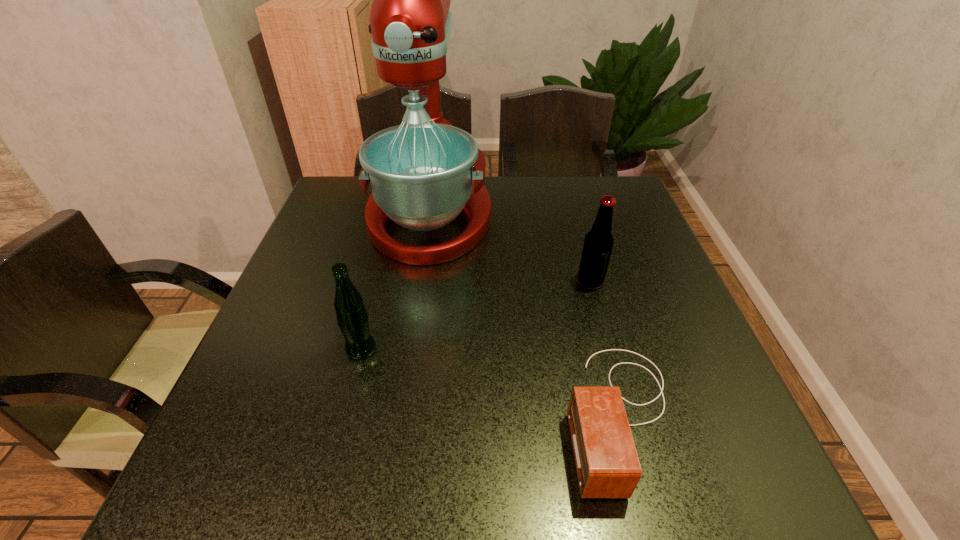
Identify the location of free spot between the farther beer bottle and the radio receiver. The image size is (960, 540). (606, 348).

At what (x,y) coordinates should I click in order to perform the action: click on object that is the closest to the nearer beer bottle. Please return your answer as a coordinate pair (x, y). Looking at the image, I should click on tap(424, 173).

You are a GUI agent. You are given a task and a screenshot of the screen. Output one action in this format:
    pyautogui.click(x=<x>, y=<y>)
    Task: Click on the object that is the second closest to the left beer bottle
    The height and width of the screenshot is (540, 960).
    Given the screenshot: What is the action you would take?
    pyautogui.click(x=607, y=465)

Where is `vacant space that satisfies the following two spatial constraints: 1. on the front-facing side of the tallest object; 2. on the left side of the second farthest object`? Image resolution: width=960 pixels, height=540 pixels. vacant space that satisfies the following two spatial constraints: 1. on the front-facing side of the tallest object; 2. on the left side of the second farthest object is located at coordinates (420, 281).

Locate an element on the screen. vacant space that satisfies the following two spatial constraints: 1. on the front-facing side of the third nearest object; 2. on the left side of the farthest object is located at coordinates (420, 281).

Image resolution: width=960 pixels, height=540 pixels. I want to click on vacant point that satisfies the following two spatial constraints: 1. on the front-facing side of the farthest object; 2. on the left side of the second farthest object, so (x=420, y=281).